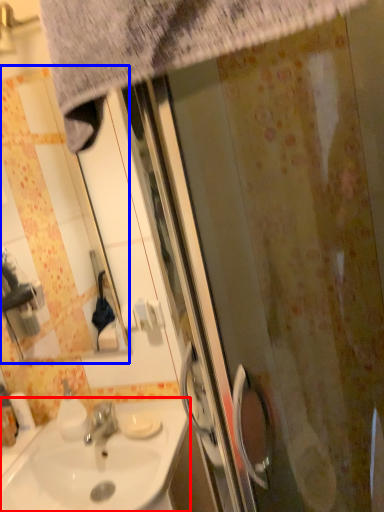
Question: Which of the following is the farthest to the observer, sink (highlighted by a red box) or mirror (highlighted by a blue box)?

Choices:
 (A) sink
 (B) mirror

Answer: (B)